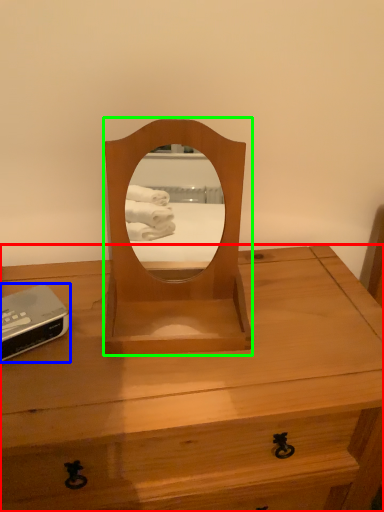
Question: Which object is positioned closest to desk (highlighted by a red box)? Select from gadget (highlighted by a blue box) and mirror (highlighted by a green box).

Choices:
 (A) gadget
 (B) mirror

Answer: (B)